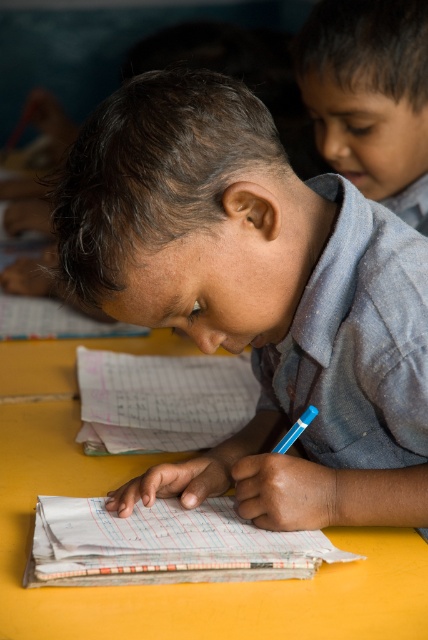
You are a photographer setting up a shot of the boy writing. To ensure both the matte blue shirt at center and yellow matte table at center are in frame, where should you position the camera relative to the boy?

Position the camera to the left of the boy so that the matte blue shirt at center, which is to the right of the yellow matte table at center, stays in frame with both objects visible.

You are a student who needs to place a blue plastic pencil at center on the yellow matte table at center. Based on the scene, can you confirm if the pencil will fit on the table?

The yellow matte table at center is to the left of the blue plastic pencil at center, so the pencil is already positioned on the table. Therefore, it can fit.

Where is the matte blue shirt at center located in the image?

The matte blue shirt at center is located at point coordinates of [256,298].